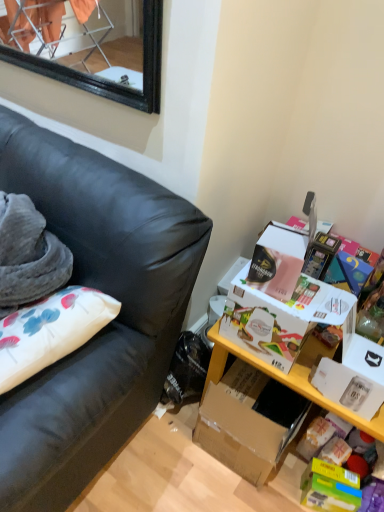
Question: From a real-world perspective, is black leather couch at left positioned under yellow wood table at lower right based on gravity?

Choices:
 (A) no
 (B) yes

Answer: (A)

Question: Is there a large distance between black leather couch at left and yellow wood table at lower right?

Choices:
 (A) no
 (B) yes

Answer: (A)

Question: From the image's perspective, is black leather couch at left over yellow wood table at lower right?

Choices:
 (A) yes
 (B) no

Answer: (A)

Question: Could you tell me if black leather couch at left is facing yellow wood table at lower right?

Choices:
 (A) yes
 (B) no

Answer: (B)

Question: Does black leather couch at left have a larger size compared to yellow wood table at lower right?

Choices:
 (A) yes
 (B) no

Answer: (A)

Question: Visually, is yellow wood table at lower right positioned to the left or to the right of black leather couch at left?

Choices:
 (A) right
 (B) left

Answer: (A)

Question: In terms of width, does yellow wood table at lower right look wider or thinner when compared to black leather couch at left?

Choices:
 (A) thin
 (B) wide

Answer: (A)

Question: Would you say yellow wood table at lower right is inside or outside black leather couch at left?

Choices:
 (A) inside
 (B) outside

Answer: (B)

Question: From the image's perspective, is yellow wood table at lower right above or below black leather couch at left?

Choices:
 (A) above
 (B) below

Answer: (B)

Question: Would you say black leather couch at left is to the left or to the right of white cardboard box at right in the picture?

Choices:
 (A) right
 (B) left

Answer: (B)

Question: In terms of size, does black leather couch at left appear bigger or smaller than white cardboard box at right?

Choices:
 (A) big
 (B) small

Answer: (A)

Question: From a real-world perspective, is black leather couch at left physically located above or below white cardboard box at right?

Choices:
 (A) below
 (B) above

Answer: (A)

Question: From the image's perspective, is black leather couch at left above or below white cardboard box at right?

Choices:
 (A) below
 (B) above

Answer: (B)

Question: Is black leather couch at left bigger or smaller than yellow wood table at lower right?

Choices:
 (A) small
 (B) big

Answer: (B)

Question: Considering the positions of black leather couch at left and yellow wood table at lower right in the image, is black leather couch at left wider or thinner than yellow wood table at lower right?

Choices:
 (A) wide
 (B) thin

Answer: (A)